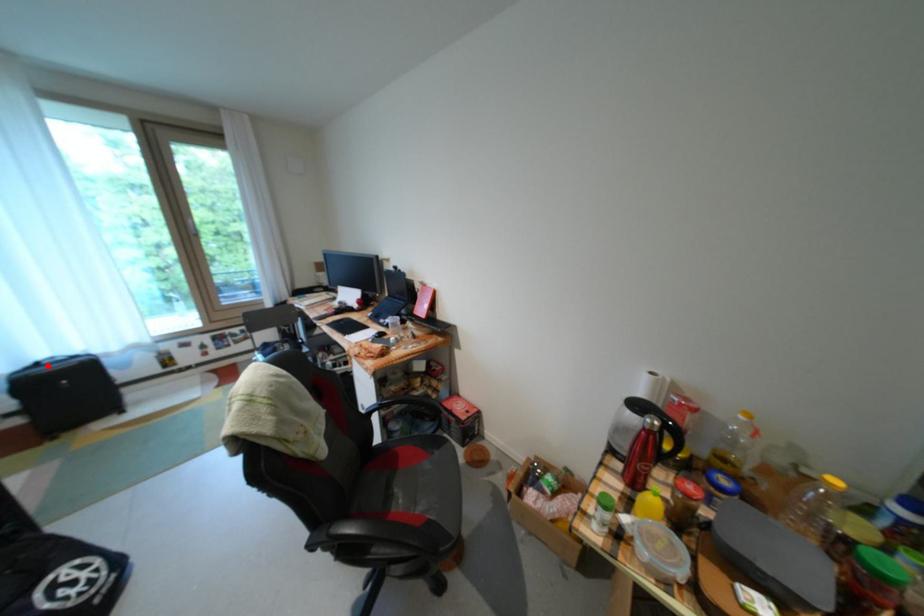
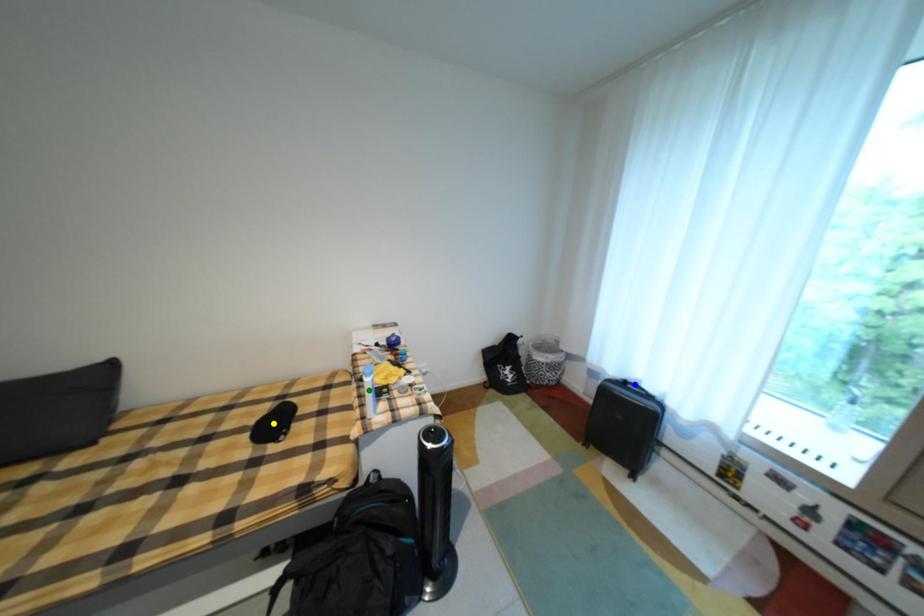
Question: I am providing you with two images of the same scene from different viewpoints. A red point is marked on the first image. You are given multiple points on the second image. Which spot in image 2 lines up with the point in image 1?

Choices:
 (A) yellow point
 (B) green point
 (C) blue point

Answer: (C)